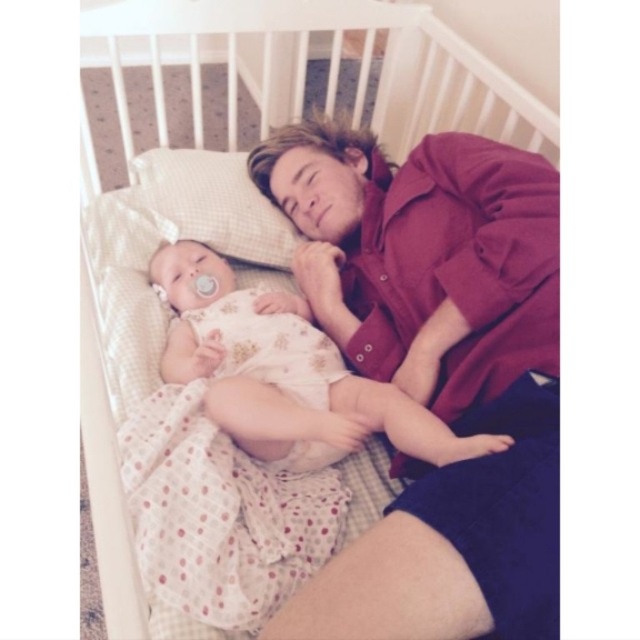
Question: Does floral cotton dress at center have a larger size compared to white checkered pillow at upper left?

Choices:
 (A) yes
 (B) no

Answer: (A)

Question: Among these objects, which one is farthest from the camera?

Choices:
 (A) floral cotton dress at center
 (B) white checkered pillow at upper left

Answer: (B)

Question: Is floral cotton dress at center bigger than white checkered pillow at upper left?

Choices:
 (A) no
 (B) yes

Answer: (B)

Question: Which object is closer to the camera taking this photo?

Choices:
 (A) white checkered pillow at upper left
 (B) floral cotton dress at center

Answer: (B)

Question: Can you confirm if floral cotton dress at center is positioned to the left of white checkered pillow at upper left?

Choices:
 (A) no
 (B) yes

Answer: (A)